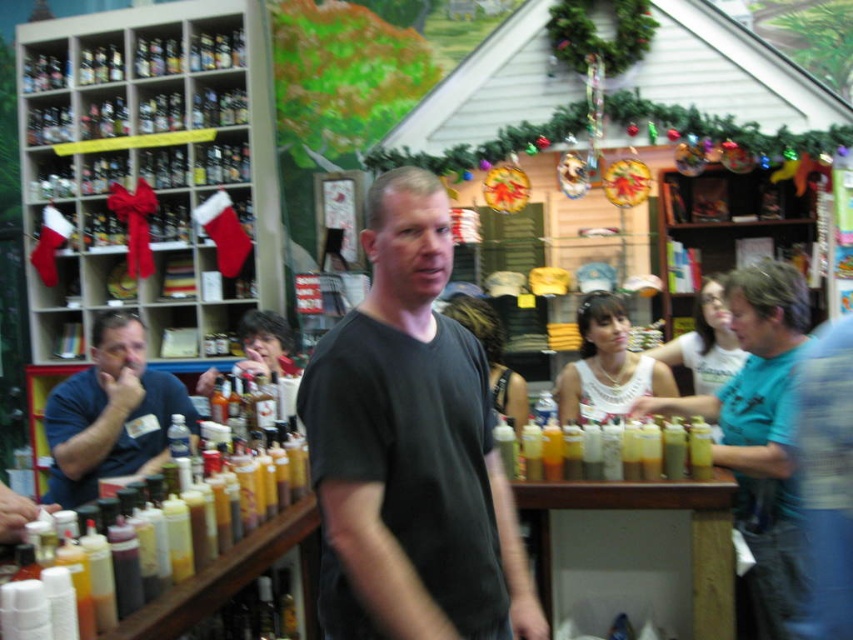
In the scene shown: Who is positioned more to the right, dark gray t-shirt at center or white lace top at center?

white lace top at center is more to the right.

Who is taller, dark gray t-shirt at center or white lace top at center?

dark gray t-shirt at center

Which is in front, point (431, 531) or point (614, 368)?

Point (431, 531) is more forward.

You are a GUI agent. You are given a task and a screenshot of the screen. Output one action in this format:
    pyautogui.click(x=<x>, y=<y>)
    Task: Click on the dark gray t-shirt at center
    
    Given the screenshot: What is the action you would take?
    pyautogui.click(x=410, y=449)

Can you confirm if matte white tank top at center is taller than matte black shirt at center?

Yes, matte white tank top at center is taller than matte black shirt at center.

From the picture: Who is shorter, matte white tank top at center or matte black shirt at center?

With less height is matte black shirt at center.

Find the location of a particular element. The image size is (853, 640). matte white tank top at center is located at coordinates (492, 356).

Who is shorter, blue shirt at left or white matte tank top at center?

white matte tank top at center is shorter.

Is point (131, 385) farther from camera compared to point (718, 378)?

No.

The image size is (853, 640). What are the coordinates of `blue shirt at left` in the screenshot? It's located at (111, 413).